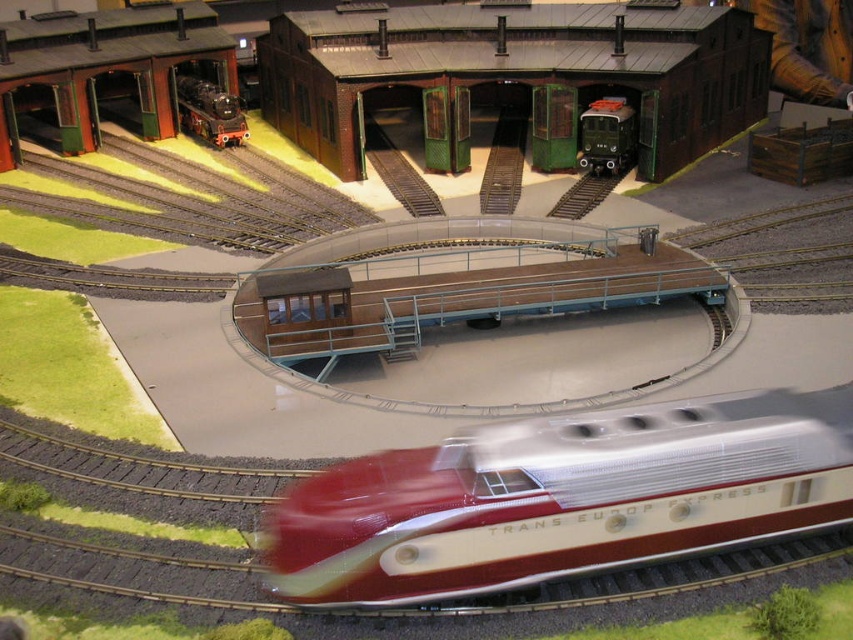
Question: Is green matte train at center bigger than polished metal locomotive at center-left?

Choices:
 (A) yes
 (B) no

Answer: (B)

Question: Which object is farther from the camera taking this photo?

Choices:
 (A) green matte train at center
 (B) polished metal locomotive at center-left
 (C) metallic silver train at center

Answer: (B)

Question: Considering the real-world distances, which object is closest to the metallic silver train at center?

Choices:
 (A) green matte train at center
 (B) polished metal locomotive at center-left

Answer: (A)

Question: Is metallic silver train at center smaller than polished metal locomotive at center-left?

Choices:
 (A) yes
 (B) no

Answer: (B)

Question: Is green matte train at center below polished metal locomotive at center-left?

Choices:
 (A) yes
 (B) no

Answer: (A)

Question: Which is farther from the polished metal locomotive at center-left?

Choices:
 (A) metallic silver train at center
 (B) green matte train at center

Answer: (A)